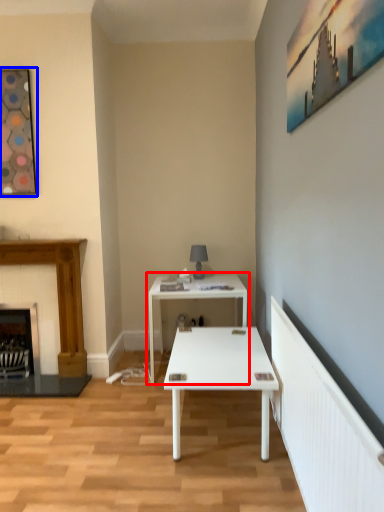
Question: Among these objects, which one is nearest to the camera, table (highlighted by a red box) or picture frame (highlighted by a blue box)?

Choices:
 (A) table
 (B) picture frame

Answer: (B)